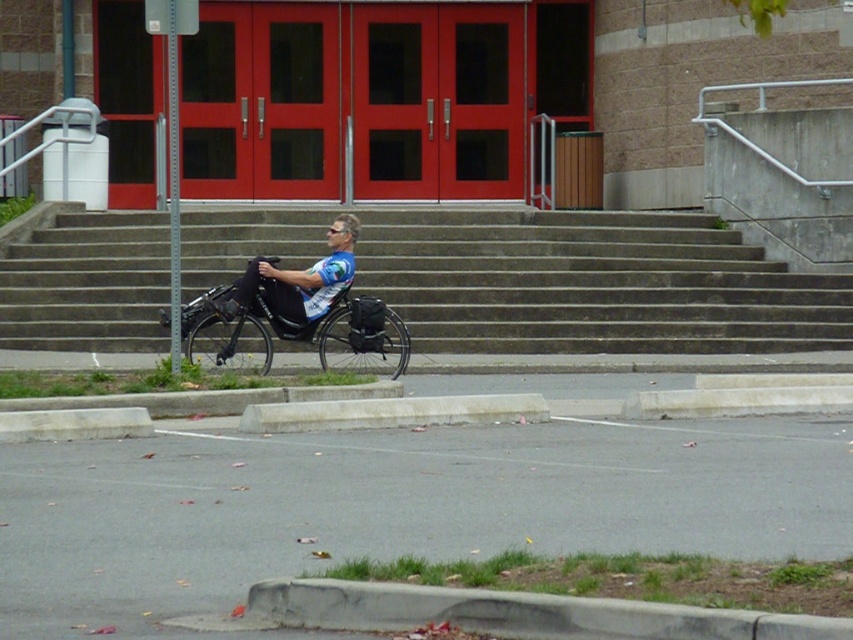
Looking at this image, is concrete stairs at center smaller than black plastic wheelchair at center?

No.

Is concrete stairs at center above black plastic wheelchair at center?

Correct, concrete stairs at center is located above black plastic wheelchair at center.

Does point (496, 230) lie behind point (352, 336)?

Yes, point (496, 230) is farther from viewer.

Find the location of `concrete stairs at center`. concrete stairs at center is located at coordinates (592, 284).